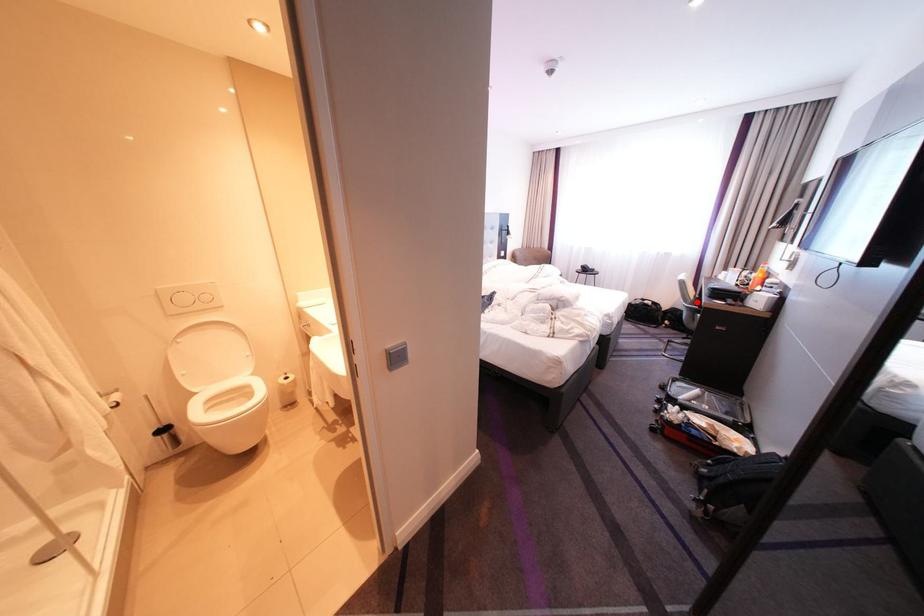
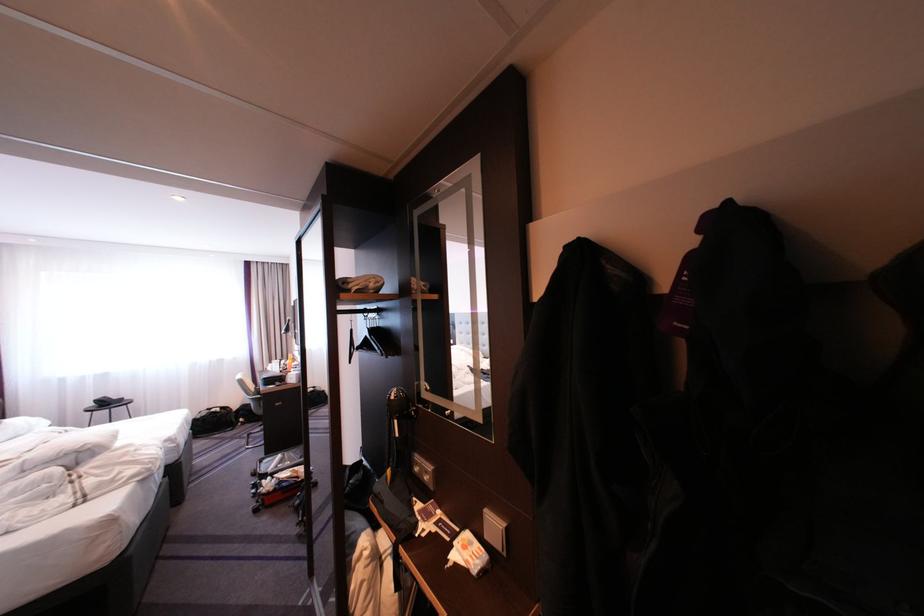
Locate, in the second image, the point that corresponds to the highlighted location in the first image.

(261, 395)